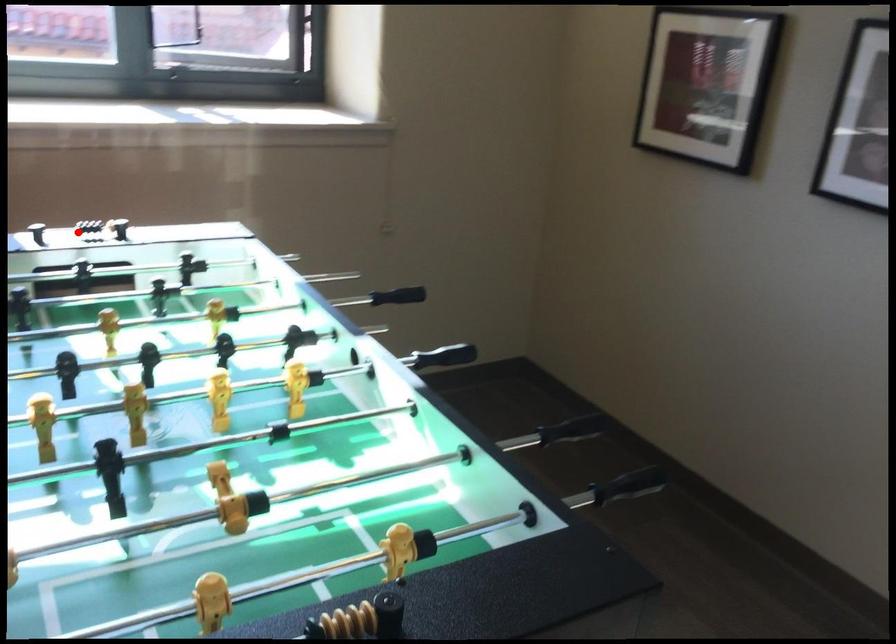
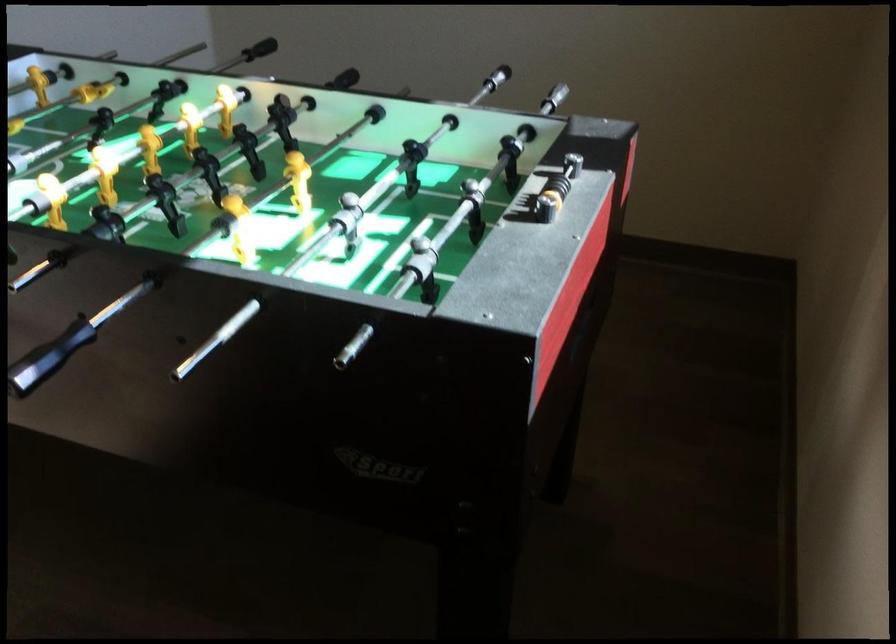
Question: I am providing you with two images of the same scene from different viewpoints. In image1, a red point is highlighted. Considering the same 3D point in image2, which of the following is correct?

Choices:
 (A) It is closer
 (B) It is farther

Answer: (A)